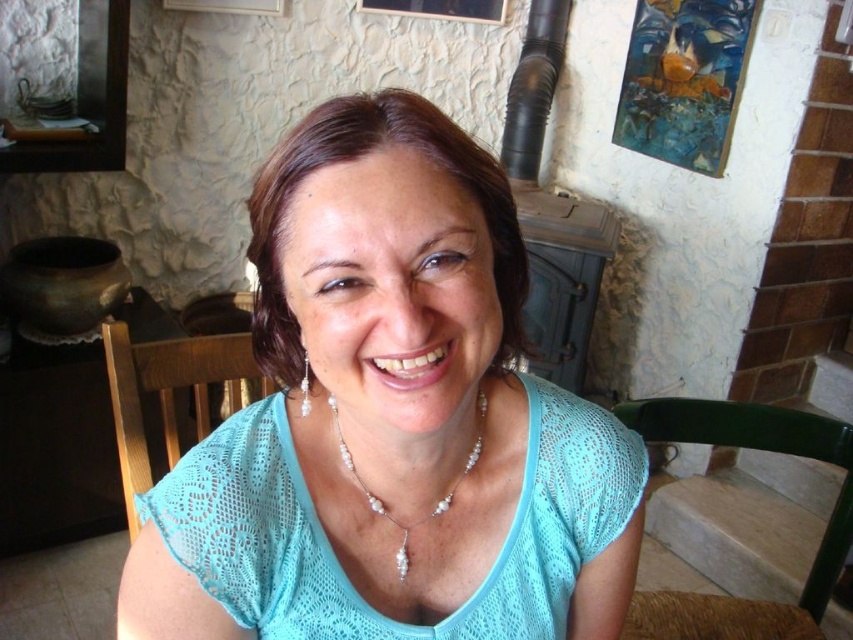
You are standing in the room and want to move from the brown wooden table at left to the wooden chair at center. Which direction should you move towards?

Since the brown wooden table at left is closer to you than the wooden chair at center, you should move towards the center of the room away from the table to reach the wooden chair at center.

Looking at this image, you are planning to place a rectangular tray that is 1 meter wide on the brown wooden table at left. Considering the wooden chair at center is nearby, will the tray fit on the table without overhanging the edges? Please explain your reasoning.

The brown wooden table at left has a width larger than the wooden chair at center. Since the tray is 1 meter wide and the table is wider than the chair, it is likely that the table can accommodate the tray without overhanging, provided the table is at least 1 meter in width. However, the exact dimensions of the table are not specified beyond being larger than the chair.